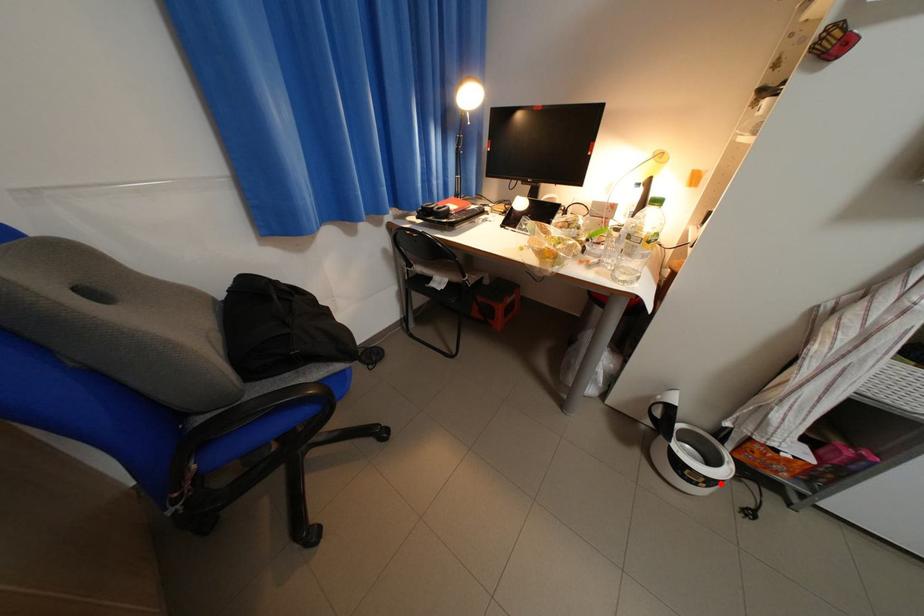
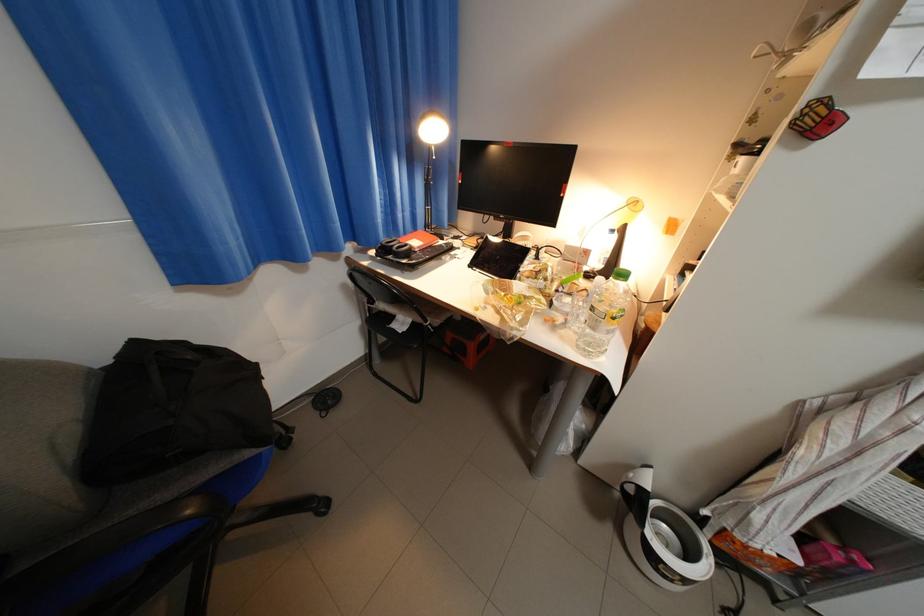
Question: I am providing you with two images of the same scene from different viewpoints. Given a red point in image1, look at the same physical point in image2. Is it:

Choices:
 (A) Closer to the viewpoint
 (B) Farther from the viewpoint

Answer: (A)